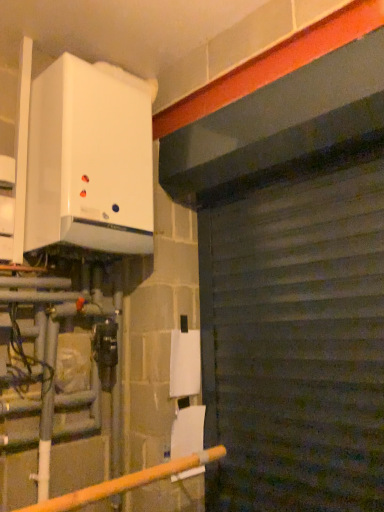
Question: Is dark gray corrugated metal at center bigger than white glossy boiler at upper left?

Choices:
 (A) yes
 (B) no

Answer: (B)

Question: Is dark gray corrugated metal at center oriented away from white glossy boiler at upper left?

Choices:
 (A) yes
 (B) no

Answer: (B)

Question: From the image's perspective, would you say dark gray corrugated metal at center is shown under white glossy boiler at upper left?

Choices:
 (A) no
 (B) yes

Answer: (B)

Question: Does dark gray corrugated metal at center have a lesser height compared to white glossy boiler at upper left?

Choices:
 (A) yes
 (B) no

Answer: (B)

Question: Is dark gray corrugated metal at center positioned in front of white glossy boiler at upper left?

Choices:
 (A) no
 (B) yes

Answer: (B)

Question: Considering the positions of point (140, 484) and point (61, 232), is point (140, 484) closer or farther from the camera than point (61, 232)?

Choices:
 (A) farther
 (B) closer

Answer: (A)

Question: Based on their positions, is yellow matte pipe at lower left located to the left or right of white glossy boiler at upper left?

Choices:
 (A) left
 (B) right

Answer: (B)

Question: Choose the correct answer: Is yellow matte pipe at lower left inside white glossy boiler at upper left or outside it?

Choices:
 (A) outside
 (B) inside

Answer: (A)

Question: From a real-world perspective, is yellow matte pipe at lower left positioned above or below white glossy boiler at upper left?

Choices:
 (A) below
 (B) above

Answer: (A)

Question: In terms of height, does dark gray corrugated metal at center look taller or shorter compared to white glossy boiler at upper left?

Choices:
 (A) tall
 (B) short

Answer: (A)

Question: From a real-world perspective, is dark gray corrugated metal at center positioned above or below white glossy boiler at upper left?

Choices:
 (A) below
 (B) above

Answer: (A)

Question: From the image's perspective, is dark gray corrugated metal at center positioned above or below white glossy boiler at upper left?

Choices:
 (A) above
 (B) below

Answer: (B)

Question: Looking at the image, does dark gray corrugated metal at center seem bigger or smaller compared to white glossy boiler at upper left?

Choices:
 (A) small
 (B) big

Answer: (A)

Question: Is dark gray corrugated metal at center inside the boundaries of yellow matte pipe at lower left, or outside?

Choices:
 (A) inside
 (B) outside

Answer: (B)

Question: Is dark gray corrugated metal at center to the left or to the right of yellow matte pipe at lower left in the image?

Choices:
 (A) right
 (B) left

Answer: (A)